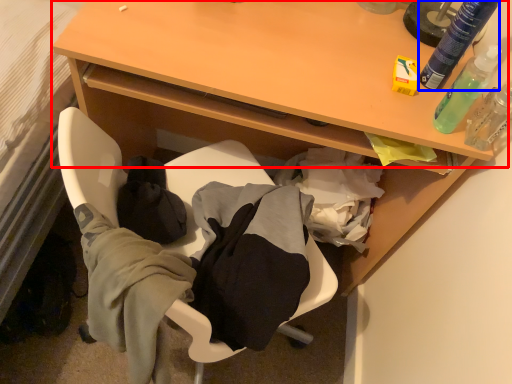
Question: Which object is closer to the camera taking this photo, table (highlighted by a red box) or bottle (highlighted by a blue box)?

Choices:
 (A) table
 (B) bottle

Answer: (B)